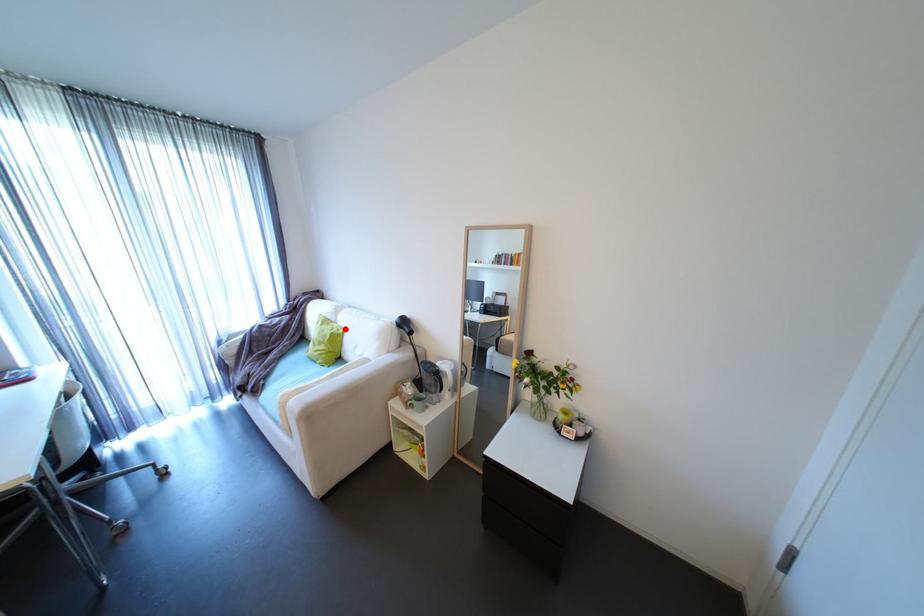
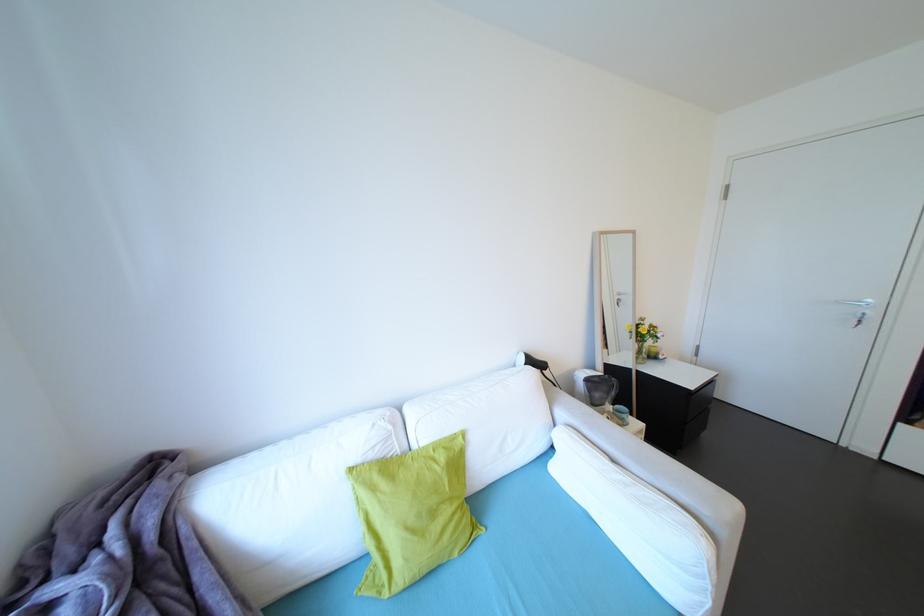
Find the pixel in the second image that matches the highlighted location in the first image.

(451, 448)